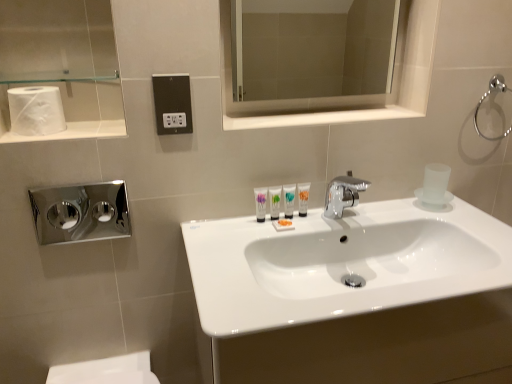
Where is `free spot in front of white glossy tube at center, the 1th toiletry viewed from the left`? The height and width of the screenshot is (384, 512). free spot in front of white glossy tube at center, the 1th toiletry viewed from the left is located at coordinates (249, 243).